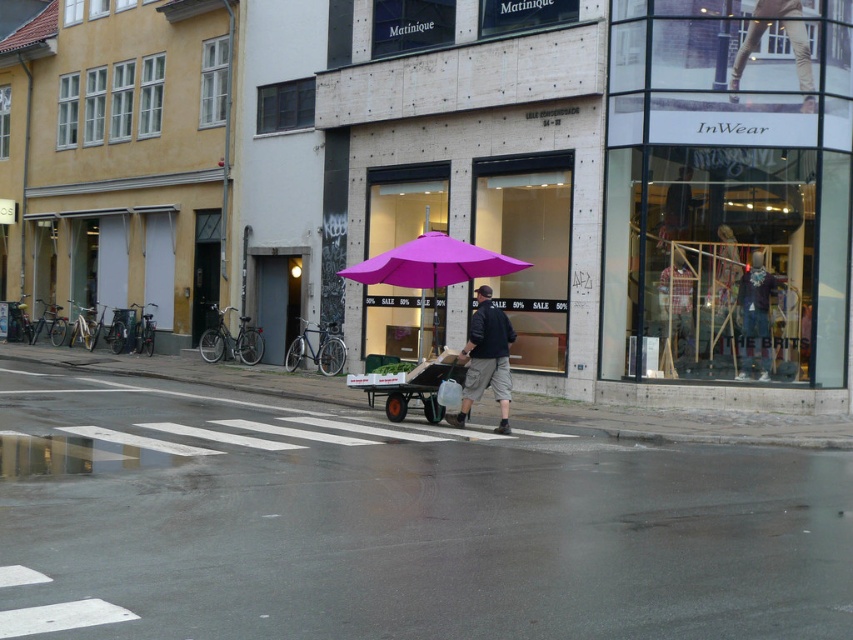
Can you confirm if dark blue cotton shirt at center is thinner than matte black jacket at center?

Incorrect, dark blue cotton shirt at center's width is not less than matte black jacket at center's.

Which is behind, point (460, 420) or point (682, 273)?

The point (682, 273) is behind.

Image resolution: width=853 pixels, height=640 pixels. I want to click on dark blue cotton shirt at center, so click(x=486, y=358).

Is purple matte umbrella at center positioned before dark blue cotton shirt at center?

That is False.

Where is `purple matte umbrella at center`? This screenshot has width=853, height=640. purple matte umbrella at center is located at coordinates (431, 269).

Is point (305, 374) in front of point (743, 276)?

No, it is behind (743, 276).

Who is more distant from viewer, (354,396) or (747,371)?

The point (354,396) is behind.

This screenshot has height=640, width=853. What do you see at coordinates (399, 513) in the screenshot?
I see `gray asphalt at center` at bounding box center [399, 513].

Where is `gray asphalt at center`? This screenshot has height=640, width=853. gray asphalt at center is located at coordinates (399, 513).